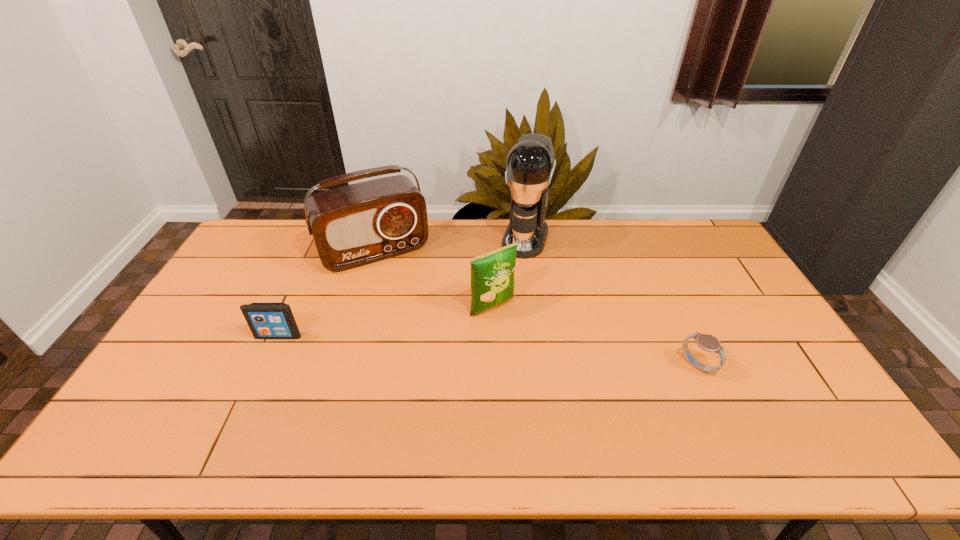
Where is `the second shortest object`? The width and height of the screenshot is (960, 540). the second shortest object is located at coordinates (266, 320).

You are a GUI agent. You are given a task and a screenshot of the screen. Output one action in this format:
    pyautogui.click(x=<x>, y=<y>)
    Task: Click on the second nearest object
    
    Given the screenshot: What is the action you would take?
    pyautogui.click(x=266, y=320)

This screenshot has width=960, height=540. Find the location of `the shortest object`. the shortest object is located at coordinates (709, 343).

Find the location of a particular element. the rightmost object is located at coordinates (709, 343).

The image size is (960, 540). What are the coordinates of `coffee maker` in the screenshot? It's located at (530, 164).

I want to click on radio receiver, so click(x=354, y=225).

Image resolution: width=960 pixels, height=540 pixels. Find the location of `crisp (potato chip)`. crisp (potato chip) is located at coordinates (492, 274).

Find the location of a particular element. the third shortest object is located at coordinates (492, 274).

At what (x,y) coordinates should I click in order to perform the action: click on free spot located on the front screen of the iPod. Please return your answer as a coordinate pair (x, y). The width and height of the screenshot is (960, 540). Looking at the image, I should click on (253, 389).

The width and height of the screenshot is (960, 540). Find the location of `vacant space situated 0.080m on the back of the rightmost object`. vacant space situated 0.080m on the back of the rightmost object is located at coordinates (681, 331).